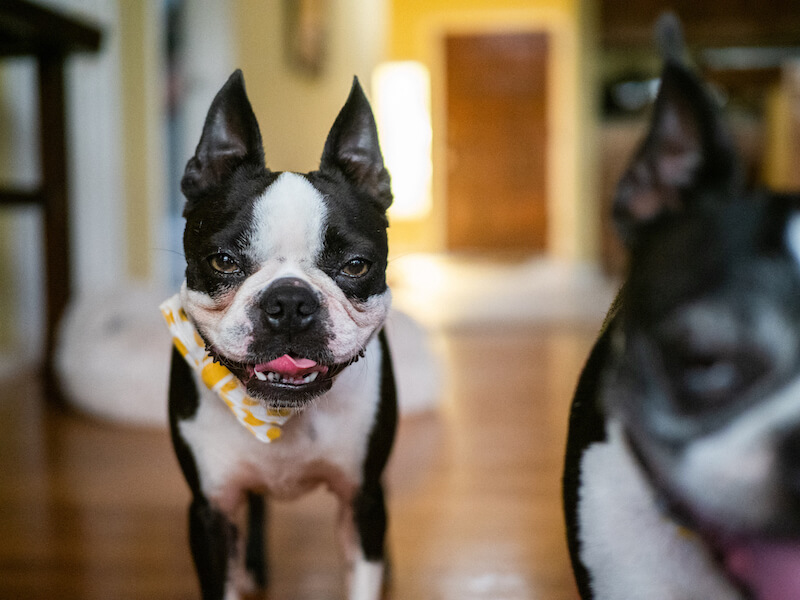
This screenshot has width=800, height=600. I want to click on yellow wall around door, so click(414, 24), click(566, 37), click(561, 212), click(402, 231).